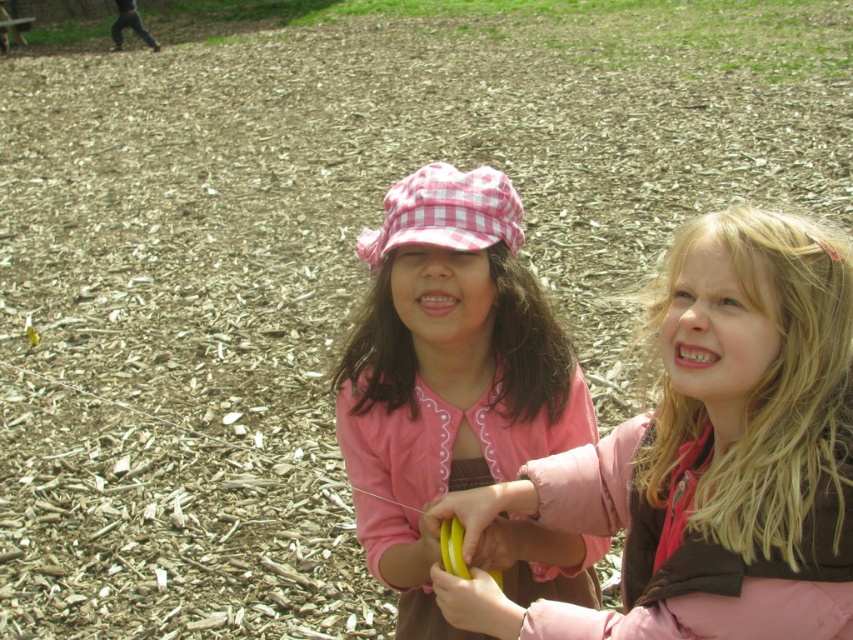
Looking at this image, you are a parent trying to decide which item to pack for a picnic. The pink gingham hat at center and the yellow rubber banana at center are both at the center of your consideration. Based on their sizes, which item is wider?

The pink gingham hat at center is wider than the yellow rubber banana at center.

Looking at this image, based on the scene description, where exactly is the pink gingham hat at center located in terms of coordinates?

The pink gingham hat at center is located at point coordinates of (445, 372).

You are a photographer trying to capture a candid shot of the two children in the park. You want to focus on the pink fabric jacket at center. Where exactly should you aim your camera to ensure the jacket is centered in your shot?

You should aim your camera at point (708, 456) to center the pink fabric jacket at center in your shot.